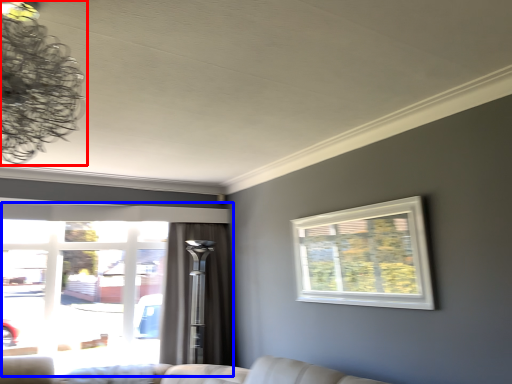
Question: Which of the following is the farthest to the observer, lamp (highlighted by a red box) or window (highlighted by a blue box)?

Choices:
 (A) lamp
 (B) window

Answer: (B)